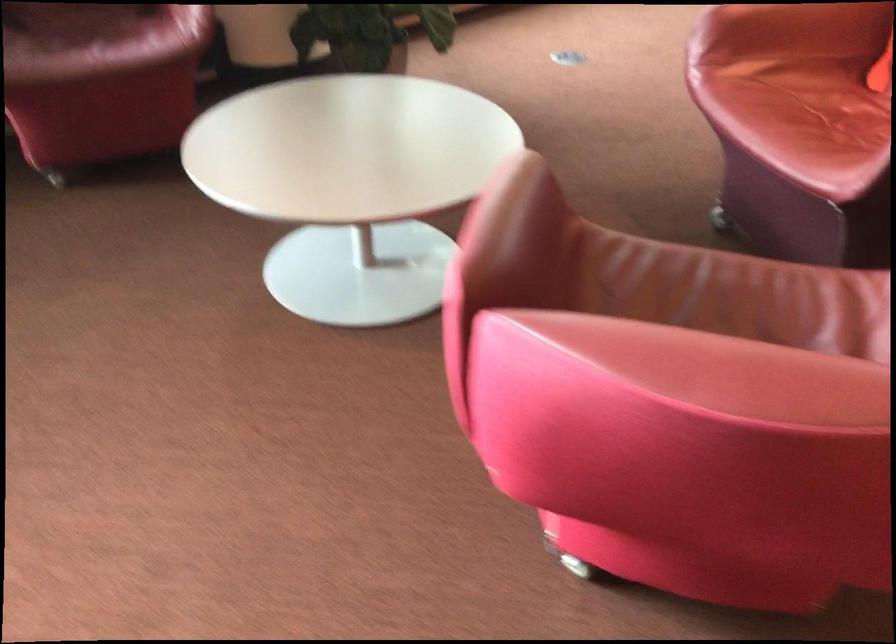
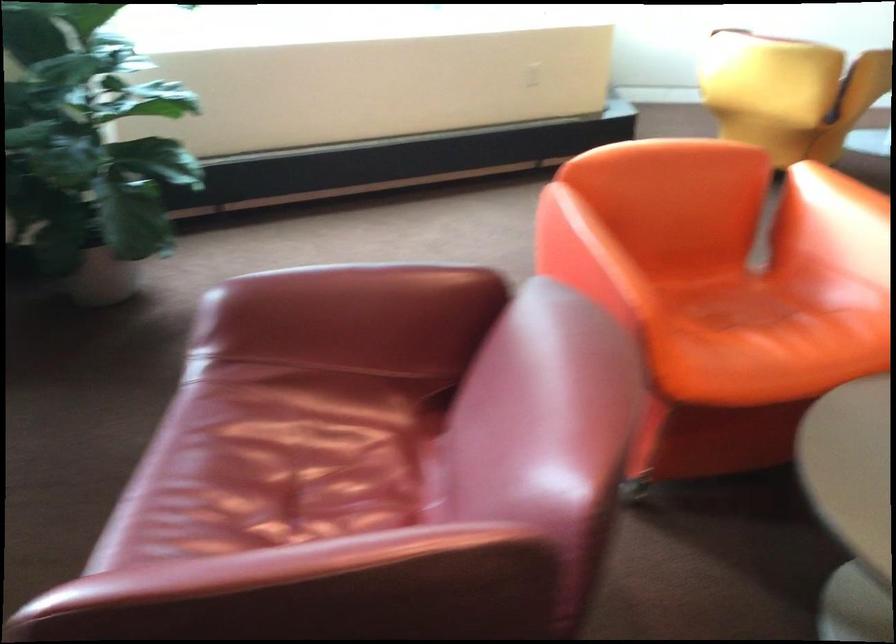
Which direction would the cameraman need to move to produce the second image?

The cameraman walked toward right, forward.